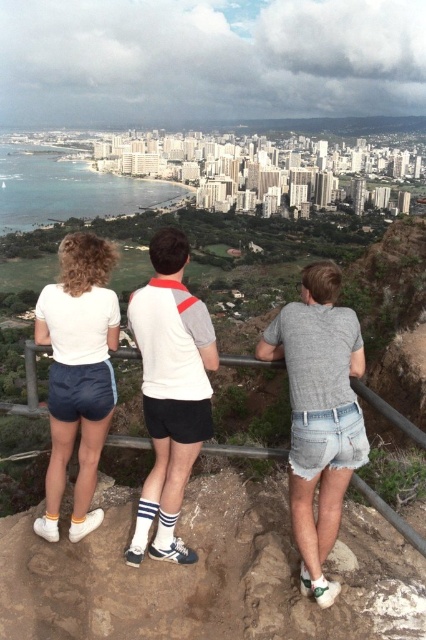
You are a photographer trying to capture a photo of the denim shorts at center and the white fabric shirt at center. Based on their heights, which one should you focus on first if you want to ensure both are in the frame without adjusting your camera angle?

The denim shorts at center has a lesser height compared to the white fabric shirt at center, so you should focus on the white fabric shirt at center first to ensure both are in the frame.

You are a photographer trying to capture a group photo of the tourists. You notice the white fabric shirt at center and the white matte shorts at left. Which clothing item should you focus on to ensure it takes up more space in the photo?

The white fabric shirt at center should be focused on because it might be wider than the white matte shorts at left, making it appear larger in the photo.